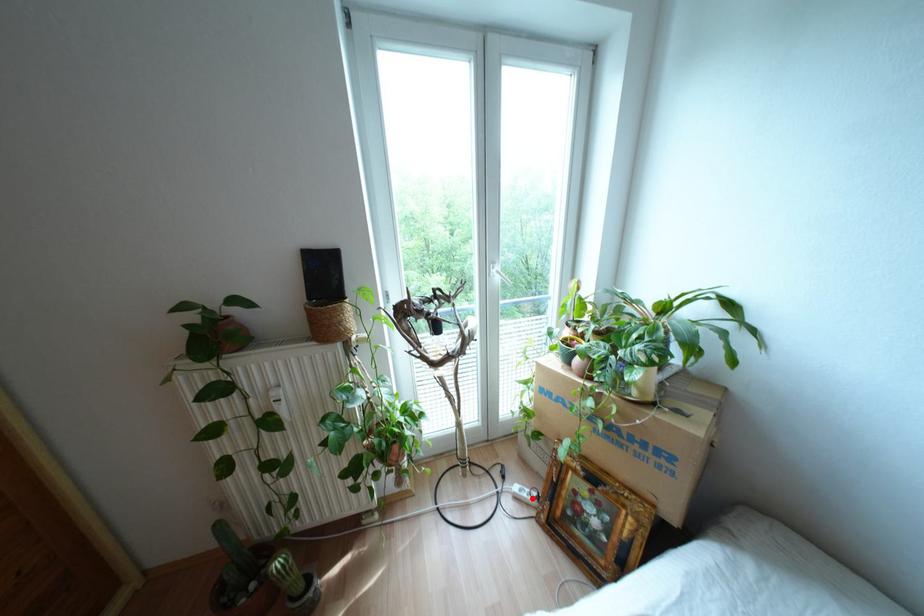
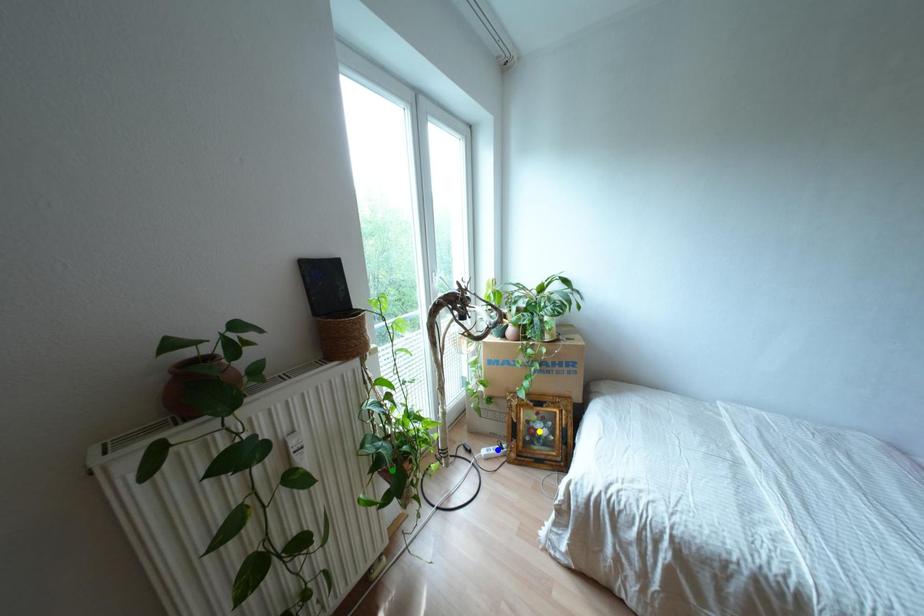
Question: I am providing you with two images of the same scene from different viewpoints. A red point is marked on the first image. You are given multiple points on the second image. Which spot in image 2 lines up with the point in image 1?

Choices:
 (A) blue point
 (B) green point
 (C) yellow point

Answer: (A)